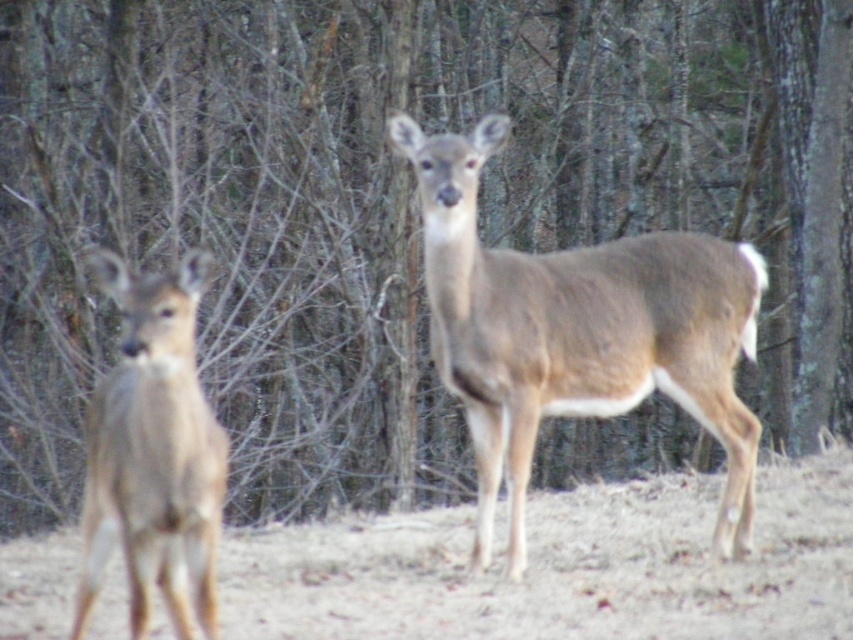
Question: Which point appears closest to the camera in this image?

Choices:
 (A) (612, 337)
 (B) (125, 355)

Answer: (B)

Question: Which of the following is the closest to the observer?

Choices:
 (A) (671, 385)
 (B) (140, 561)

Answer: (B)

Question: Does brown fur deer at center have a greater width compared to brown fur deer at left?

Choices:
 (A) yes
 (B) no

Answer: (A)

Question: Is brown fur deer at center to the left of brown fur deer at left from the viewer's perspective?

Choices:
 (A) yes
 (B) no

Answer: (B)

Question: Observing the image, what is the correct spatial positioning of brown fur deer at center in reference to brown fur deer at left?

Choices:
 (A) right
 (B) left

Answer: (A)

Question: Which point appears farthest from the camera in this image?

Choices:
 (A) (480, 294)
 (B) (132, 394)

Answer: (A)